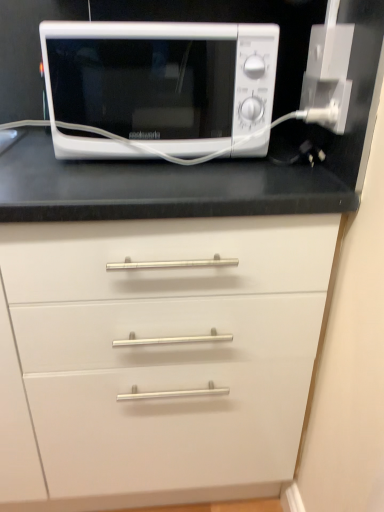
This screenshot has width=384, height=512. Describe the element at coordinates (326, 102) in the screenshot. I see `white plastic outlet at upper right` at that location.

This screenshot has height=512, width=384. Find the location of `white plastic outlet at upper right`. white plastic outlet at upper right is located at coordinates (326, 102).

The width and height of the screenshot is (384, 512). Describe the element at coordinates (157, 85) in the screenshot. I see `white matte microwave at upper center` at that location.

At what (x,y) coordinates should I click in order to perform the action: click on white matte microwave at upper center. Please return your answer as a coordinate pair (x, y). Looking at the image, I should click on (157, 85).

This screenshot has height=512, width=384. What are the coordinates of `white plastic outlet at upper right` in the screenshot? It's located at (326, 102).

Considering the positions of objects white plastic outlet at upper right and white matte microwave at upper center in the image provided, who is more to the left, white plastic outlet at upper right or white matte microwave at upper center?

white matte microwave at upper center.

Is white plastic outlet at upper right in front of or behind white matte microwave at upper center in the image?

In the image, white plastic outlet at upper right appears behind white matte microwave at upper center.

Between point (341, 132) and point (69, 24), which one is positioned behind?

The point (341, 132) is more distant.

From the picture: From the image's perspective, relative to white matte microwave at upper center, is white plastic outlet at upper right above or below?

Based on their image positions, white plastic outlet at upper right is located beneath white matte microwave at upper center.

From a real-world perspective, which object rests below the other?

From a 3D spatial view, white plastic outlet at upper right is below.

Which object is wider, white plastic outlet at upper right or white matte microwave at upper center?

white matte microwave at upper center.

Is white plastic outlet at upper right taller than white matte microwave at upper center?

In fact, white plastic outlet at upper right may be shorter than white matte microwave at upper center.

Does white plastic outlet at upper right have a larger size compared to white matte microwave at upper center?

No.

From the picture: Is white plastic outlet at upper right not within white matte microwave at upper center?

Yes, white plastic outlet at upper right is located beyond the bounds of white matte microwave at upper center.

Is white plastic outlet at upper right beside white matte microwave at upper center?

There is a gap between white plastic outlet at upper right and white matte microwave at upper center.

Is white plastic outlet at upper right aimed at white matte microwave at upper center?

Yes, white plastic outlet at upper right faces towards white matte microwave at upper center.

Measure the distance from white plastic outlet at upper right to white matte microwave at upper center.

The distance of white plastic outlet at upper right from white matte microwave at upper center is 27.41 centimeters.

Find the location of a particular element. The image size is (384, 512). microwave oven that appears in front of the white plastic outlet at upper right is located at coordinates (157, 85).

Is white matte microwave at upper center at the right side of white plastic outlet at upper right?

In fact, white matte microwave at upper center is to the left of white plastic outlet at upper right.

Which is in front, white matte microwave at upper center or white plastic outlet at upper right?

white matte microwave at upper center is closer to the camera.

Which is closer to the camera, (x=218, y=134) or (x=342, y=120)?

Point (x=218, y=134) is farther from the camera than point (x=342, y=120).

Consider the image. From the image's perspective, is white matte microwave at upper center located above or below white plastic outlet at upper right?

white matte microwave at upper center is situated higher than white plastic outlet at upper right in the image.

From a real-world perspective, which object stands above the other?

In real-world perspective, white matte microwave at upper center is above.

Which of these two, white matte microwave at upper center or white plastic outlet at upper right, is thinner?

white plastic outlet at upper right is thinner.

Based on the photo, who is taller, white matte microwave at upper center or white plastic outlet at upper right?

white matte microwave at upper center.

Who is smaller, white matte microwave at upper center or white plastic outlet at upper right?

white plastic outlet at upper right is smaller.

Is white matte microwave at upper center not within white plastic outlet at upper right?

Yes, white matte microwave at upper center is located beyond the bounds of white plastic outlet at upper right.

Are white matte microwave at upper center and white plastic outlet at upper right far apart?

white matte microwave at upper center is near white plastic outlet at upper right, not far away.

Is white matte microwave at upper center facing towards white plastic outlet at upper right?

No, white matte microwave at upper center is not aimed at white plastic outlet at upper right.

What's the angular difference between white matte microwave at upper center and white plastic outlet at upper right's facing directions?

The angular difference between white matte microwave at upper center and white plastic outlet at upper right is 90.6 degrees.

Identify the location of electric outlet below the white matte microwave at upper center (from the image's perspective). The image size is (384, 512). (326, 102).

Find the location of `electric outlet below the white matte microwave at upper center (from the image's perspective)`. electric outlet below the white matte microwave at upper center (from the image's perspective) is located at coordinates (326, 102).

Find the location of a particular element. The image size is (384, 512). microwave oven above the white plastic outlet at upper right (from the image's perspective) is located at coordinates (157, 85).